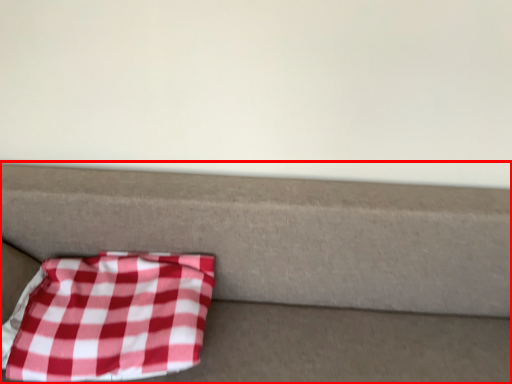
Question: Where is furniture (annotated by the red box) located in relation to blanket in the image?

Choices:
 (A) right
 (B) left

Answer: (A)